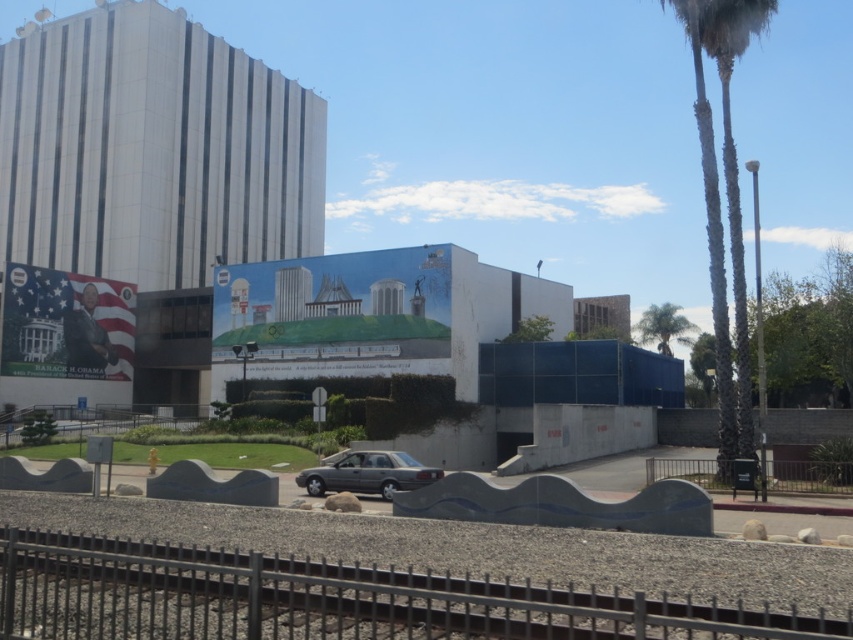
What are the coordinates of `metallic silver fence at lower right` in the screenshot? It's located at (807, 476).

You are a GUI agent. You are given a task and a screenshot of the screen. Output one action in this format:
    pyautogui.click(x=<x>, y=<y>)
    Task: Click on the metallic silver fence at lower right
    
    Given the screenshot: What is the action you would take?
    pyautogui.click(x=807, y=476)

Between black metal fence at lower center and green textured palm tree at right, which one appears on the left side from the viewer's perspective?

black metal fence at lower center is more to the left.

Does point (276, 605) lie in front of point (741, 328)?

That is True.

Identify the location of black metal fence at lower center. This screenshot has height=640, width=853. (328, 600).

Is the position of green textured palm tree at right less distant than that of satin silver sedan at center?

No, green textured palm tree at right is further to the viewer.

Identify the location of green textured palm tree at right. (727, 202).

Measure the distance between point (770, 10) and camera.

31.10 meters

Find the location of a particular element. This screenshot has width=853, height=640. green textured palm tree at right is located at coordinates (727, 202).